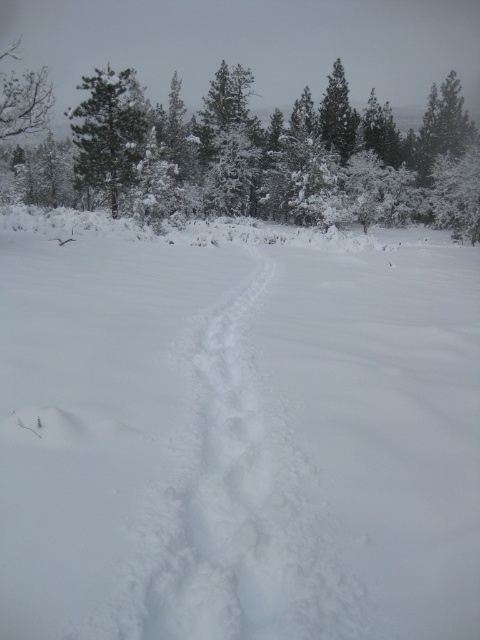
You are standing in the winter landscape and want to walk from the point at coordinates point (240, 211) to the point at coordinates point (212, 451). Which direction should you move to get closer to your destination?

Since point (240, 211) is further to the viewer than point (212, 451), you should move forward towards the background to reach point (212, 451).